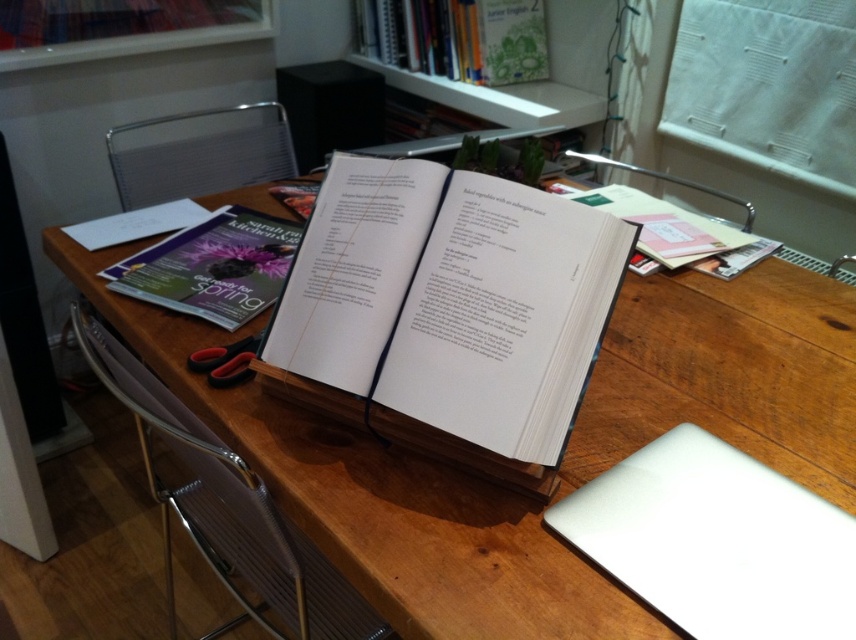
Where is `white paper at center`? white paper at center is located at coordinates (447, 310).

Does white paper at center have a larger size compared to black rubber scissors at lower left?

Yes, white paper at center is bigger than black rubber scissors at lower left.

Does point (462, 336) come in front of point (205, 356)?

Yes, it is in front of point (205, 356).

Image resolution: width=856 pixels, height=640 pixels. I want to click on white paper at center, so click(447, 310).

Is purple matte magazine at left below hardcover book at upper center?

Yes, purple matte magazine at left is below hardcover book at upper center.

Which is in front, point (165, 244) or point (519, 58)?

Point (165, 244) is more forward.

Where is `purple matte magazine at left`? The image size is (856, 640). purple matte magazine at left is located at coordinates (214, 266).

The image size is (856, 640). In order to click on purple matte magazine at left in this screenshot , I will do `click(214, 266)`.

Looking at this image, between metallic silver chair at center and metallic silver chair at upper center, which one is positioned higher?

metallic silver chair at upper center is higher up.

The height and width of the screenshot is (640, 856). Describe the element at coordinates (227, 509) in the screenshot. I see `metallic silver chair at center` at that location.

Locate an element on the screen. Image resolution: width=856 pixels, height=640 pixels. metallic silver chair at center is located at coordinates (227, 509).